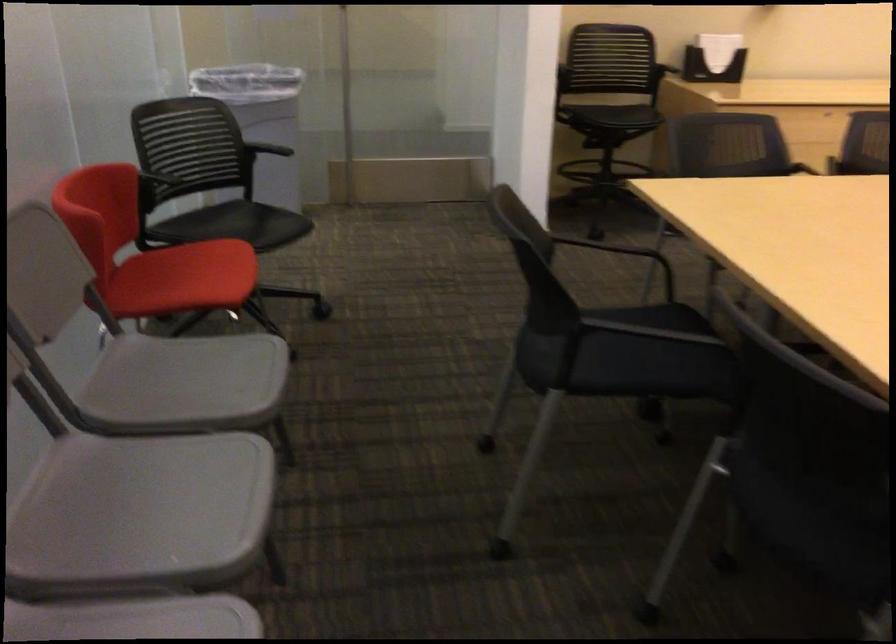
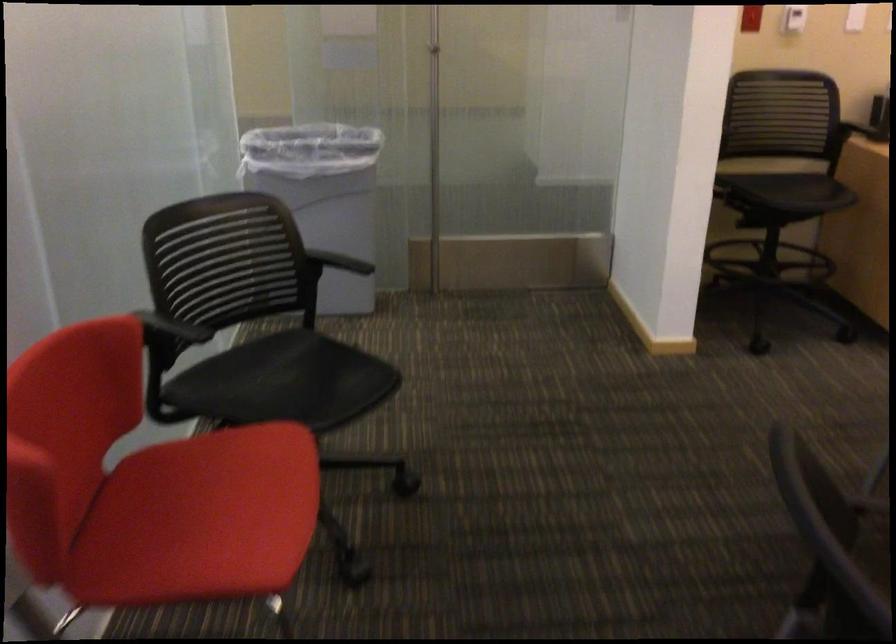
Where in the second image is the point corresponding to (x=177, y=281) from the first image?

(200, 518)